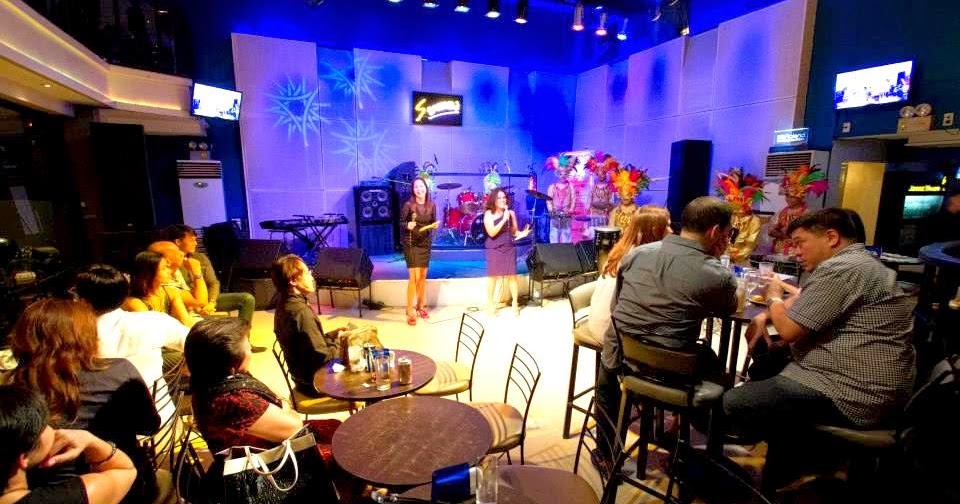
Locate an element on the screen. The height and width of the screenshot is (504, 960). wall is located at coordinates (315, 157), (728, 117).